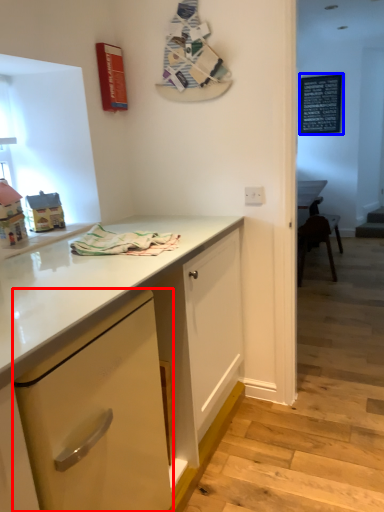
Question: Which object is closer to the camera taking this photo, cabinetry (highlighted by a red box) or bulletin board (highlighted by a blue box)?

Choices:
 (A) cabinetry
 (B) bulletin board

Answer: (A)